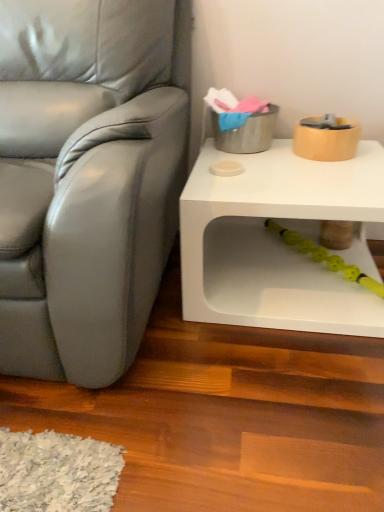
Question: Is yellow rubber toy at lower center closer to camera compared to white matte table at lower right?

Choices:
 (A) yes
 (B) no

Answer: (B)

Question: From a real-world perspective, is yellow rubber toy at lower center under white matte table at lower right?

Choices:
 (A) yes
 (B) no

Answer: (A)

Question: Can you confirm if yellow rubber toy at lower center is wider than white matte table at lower right?

Choices:
 (A) yes
 (B) no

Answer: (B)

Question: Is yellow rubber toy at lower center bigger than white matte table at lower right?

Choices:
 (A) yes
 (B) no

Answer: (B)

Question: Is yellow rubber toy at lower center far away from white matte table at lower right?

Choices:
 (A) no
 (B) yes

Answer: (A)

Question: Looking at their shapes, would you say white matte table at lower right is wider or thinner than yellow rubber toy at lower center?

Choices:
 (A) thin
 (B) wide

Answer: (B)

Question: From their relative heights in the image, would you say white matte table at lower right is taller or shorter than yellow rubber toy at lower center?

Choices:
 (A) short
 (B) tall

Answer: (B)

Question: From the image's perspective, relative to yellow rubber toy at lower center, is white matte table at lower right above or below?

Choices:
 (A) below
 (B) above

Answer: (B)

Question: Visually, is white matte table at lower right positioned to the left or to the right of yellow rubber toy at lower center?

Choices:
 (A) right
 (B) left

Answer: (B)

Question: Visually, is white matte table at lower right positioned to the left or to the right of satin gray leather chair at left?

Choices:
 (A) left
 (B) right

Answer: (B)

Question: Would you say white matte table at lower right is inside or outside satin gray leather chair at left?

Choices:
 (A) inside
 (B) outside

Answer: (B)

Question: From the image's perspective, is white matte table at lower right above or below satin gray leather chair at left?

Choices:
 (A) above
 (B) below

Answer: (B)

Question: Considering the positions of white matte table at lower right and satin gray leather chair at left in the image, is white matte table at lower right taller or shorter than satin gray leather chair at left?

Choices:
 (A) short
 (B) tall

Answer: (A)

Question: Is satin gray leather chair at left bigger or smaller than yellow rubber toy at lower center?

Choices:
 (A) small
 (B) big

Answer: (B)

Question: Looking at their shapes, would you say satin gray leather chair at left is wider or thinner than yellow rubber toy at lower center?

Choices:
 (A) wide
 (B) thin

Answer: (A)